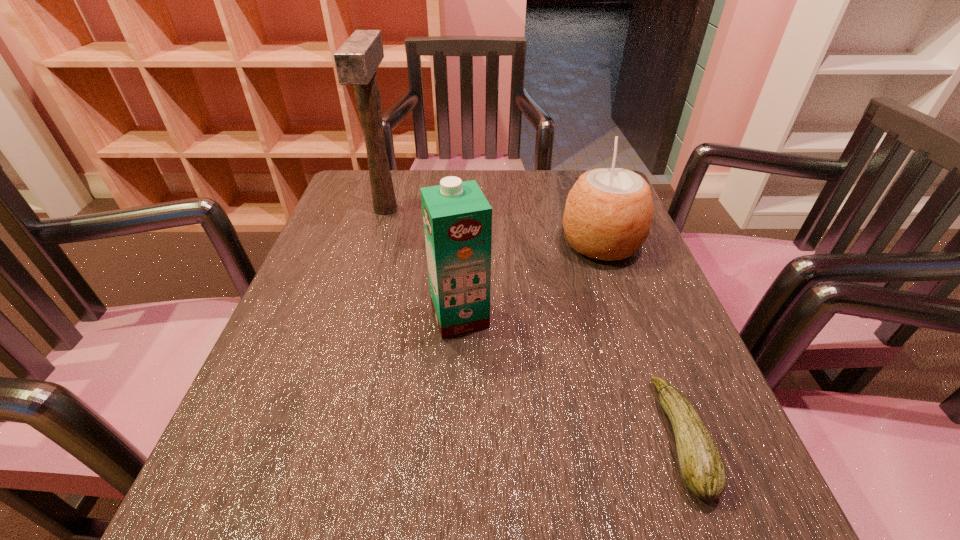
You are a GUI agent. You are given a task and a screenshot of the screen. Output one action in this format:
    pyautogui.click(x=<x>, y=<y>)
    Task: Click on the unoccupied area between the leftmost object and the nearest object
    
    Given the screenshot: What is the action you would take?
    pyautogui.click(x=534, y=323)

The width and height of the screenshot is (960, 540). Find the location of `free point between the third farthest object and the coconut`. free point between the third farthest object and the coconut is located at coordinates (530, 280).

Identify the location of free space between the nearest object and the coconut. (641, 341).

The height and width of the screenshot is (540, 960). In order to click on free space between the coconut and the shortest object in this screenshot , I will do point(641,341).

The width and height of the screenshot is (960, 540). What are the coordinates of `vacant area between the third farthest object and the coconut` in the screenshot? It's located at (530, 280).

The height and width of the screenshot is (540, 960). Find the location of `free space between the third tallest object and the leftmost object`. free space between the third tallest object and the leftmost object is located at coordinates pos(493,226).

Locate an element on the screen. The width and height of the screenshot is (960, 540). empty space that is in between the third shortest object and the shortest object is located at coordinates (570, 377).

Where is `object that is the third closest to the mallet`? object that is the third closest to the mallet is located at coordinates (702, 468).

Find the location of a particular element. The height and width of the screenshot is (540, 960). object that can be found as the closest to the second object from left to right is located at coordinates (608, 213).